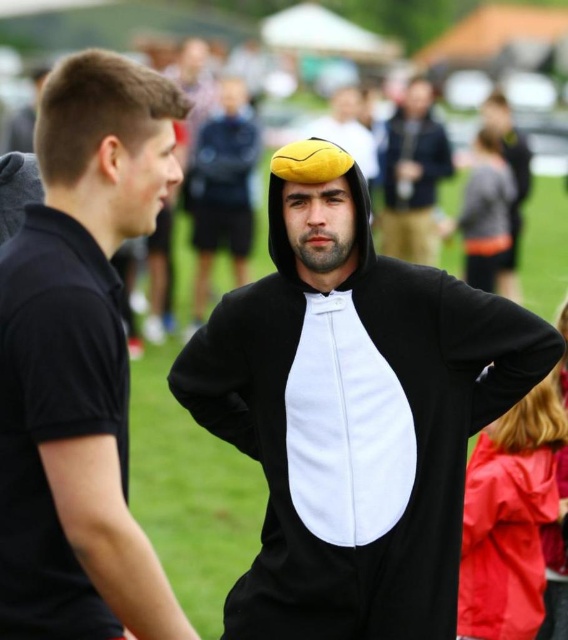
Can you confirm if black fleece onesie at right is bigger than rubberized red raincoat at lower right?

Yes, black fleece onesie at right is bigger than rubberized red raincoat at lower right.

Is black fleece onesie at right below rubberized red raincoat at lower right?

Actually, black fleece onesie at right is above rubberized red raincoat at lower right.

Where is `black fleece onesie at right`? black fleece onesie at right is located at coordinates (53, 416).

Does black matte costume at center have a lesser height compared to rubberized red raincoat at lower right?

No.

Is point (365, 458) positioned after point (549, 497)?

No.

Find the location of `black matte costume at center`. black matte costume at center is located at coordinates (352, 412).

Does black matte costume at center have a smaller size compared to matte yellow beret at upper center?

Yes, black matte costume at center is smaller than matte yellow beret at upper center.

Which is more to the right, black matte costume at center or matte yellow beret at upper center?

From the viewer's perspective, matte yellow beret at upper center appears more on the right side.

Does point (344, 289) lie behind point (428, 192)?

No, it is in front of (428, 192).

The image size is (568, 640). What are the coordinates of `black matte costume at center` in the screenshot? It's located at (352, 412).